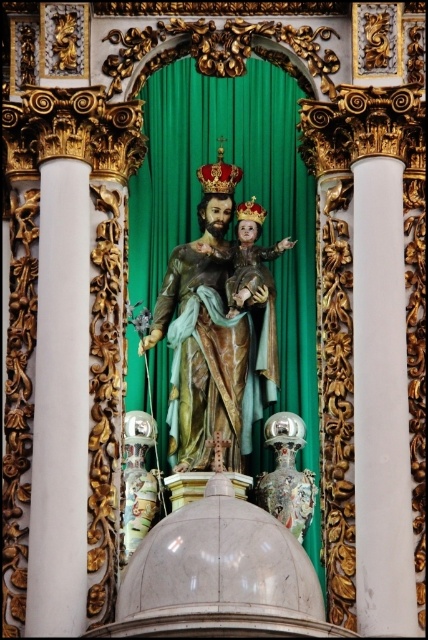
You are an art conservator assessing the space needed to transport both the green velvet curtain at center and the polychrome wood statue at center. Based on their sizes, which object requires more storage space?

The green velvet curtain at center requires more storage space since it is larger in size than the polychrome wood statue at center.

You are an art conservator examining the religious altar. You notice the green velvet curtain at center and the polychrome wood statue at center. Which object is positioned lower in the scene?

The green velvet curtain at center is located below the polychrome wood statue at center, so it is positioned lower in the scene.